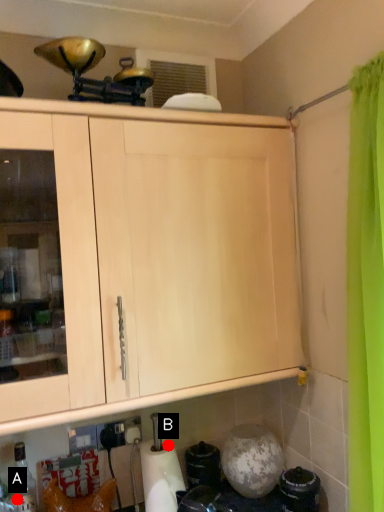
Question: Two points are circled on the image, labeled by A and B beside each circle. Which point is closer to the camera?

Choices:
 (A) A is closer
 (B) B is closer

Answer: (A)